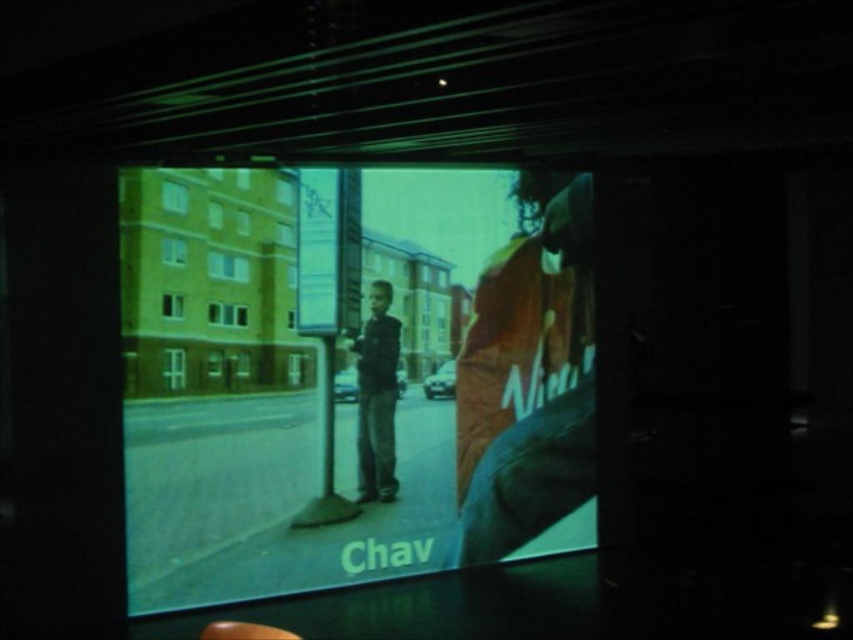
Can you confirm if orange fabric shirt at right is positioned to the left of dark blue jeans at center?

Incorrect, orange fabric shirt at right is not on the left side of dark blue jeans at center.

Describe the element at coordinates (527, 378) in the screenshot. I see `orange fabric shirt at right` at that location.

Find the location of `orange fabric shirt at right`. orange fabric shirt at right is located at coordinates point(527,378).

Which is below, matte plastic screen at center or dark blue jeans at center?

Positioned lower is dark blue jeans at center.

The image size is (853, 640). I want to click on matte plastic screen at center, so click(350, 376).

At what (x,y) coordinates should I click in order to perform the action: click on matte plastic screen at center. Please return your answer as a coordinate pair (x, y). Image resolution: width=853 pixels, height=640 pixels. Looking at the image, I should click on (350, 376).

The width and height of the screenshot is (853, 640). Find the location of `matte plastic screen at center`. matte plastic screen at center is located at coordinates (350, 376).

The image size is (853, 640). Identify the location of matte plastic screen at center. (350, 376).